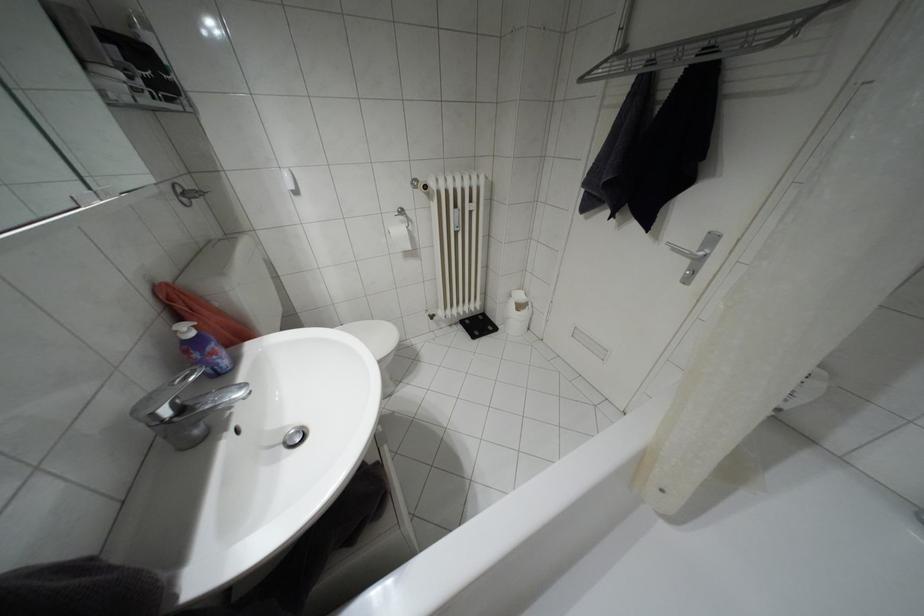
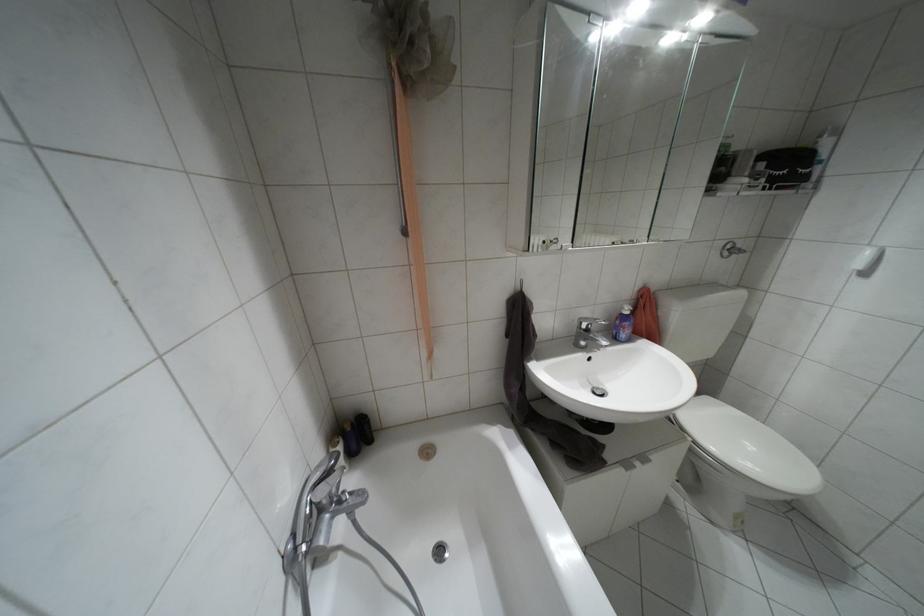
How did the camera likely rotate?

The camera rotated toward left-down.